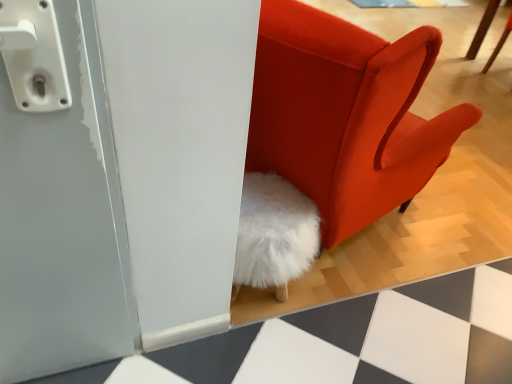
Question: Does velvet orange chair at center have a smaller size compared to white fluffy chair at upper right?

Choices:
 (A) yes
 (B) no

Answer: (B)

Question: From the image's perspective, is velvet orange chair at center located beneath white fluffy chair at upper right?

Choices:
 (A) no
 (B) yes

Answer: (B)

Question: From a real-world perspective, does velvet orange chair at center stand above white fluffy chair at upper right?

Choices:
 (A) yes
 (B) no

Answer: (A)

Question: Is velvet orange chair at center oriented away from white fluffy chair at upper right?

Choices:
 (A) no
 (B) yes

Answer: (A)

Question: Could you tell me if velvet orange chair at center is facing white fluffy chair at upper right?

Choices:
 (A) yes
 (B) no

Answer: (A)

Question: From a real-world perspective, is velvet orange chair at center under white fluffy chair at upper right?

Choices:
 (A) no
 (B) yes

Answer: (A)

Question: Is white fluffy chair at upper right not inside velvet orange chair at center?

Choices:
 (A) no
 (B) yes

Answer: (B)

Question: Can you confirm if white fluffy chair at upper right is bigger than velvet orange chair at center?

Choices:
 (A) no
 (B) yes

Answer: (A)

Question: Is white fluffy chair at upper right placed right next to velvet orange chair at center?

Choices:
 (A) yes
 (B) no

Answer: (B)

Question: From the image's perspective, does white fluffy chair at upper right appear lower than velvet orange chair at center?

Choices:
 (A) yes
 (B) no

Answer: (B)

Question: Is white fluffy chair at upper right oriented towards velvet orange chair at center?

Choices:
 (A) yes
 (B) no

Answer: (B)

Question: Is white fluffy chair at upper right turned away from velvet orange chair at center?

Choices:
 (A) no
 (B) yes

Answer: (A)

Question: Looking at the image, does white fluffy chair at upper right seem bigger or smaller compared to velvet orange chair at center?

Choices:
 (A) big
 (B) small

Answer: (B)